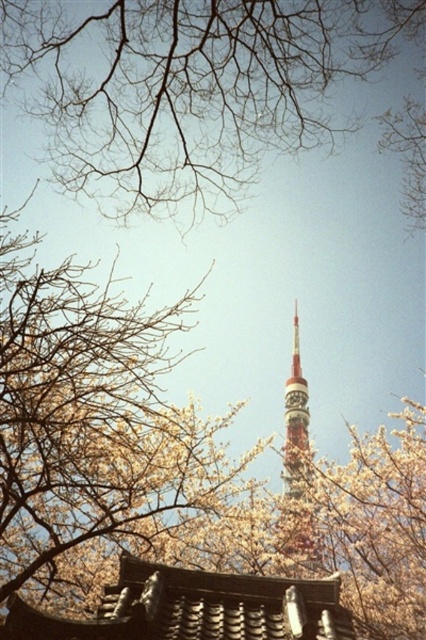
Between bare branches at upper center and shiny metallic tower at center, which one appears on the right side from the viewer's perspective?

Positioned to the right is shiny metallic tower at center.

Looking at this image, can you confirm if bare branches at upper center is thinner than shiny metallic tower at center?

No, bare branches at upper center is not thinner than shiny metallic tower at center.

At what (x,y) coordinates should I click in order to perform the action: click on bare branches at upper center. Please return your answer as a coordinate pair (x, y). Looking at the image, I should click on (190, 88).

Where is `bare branches at upper center`? bare branches at upper center is located at coordinates (190, 88).

Is fluffy white blossoms at center above shiny metallic tower at center?

Indeed, fluffy white blossoms at center is positioned over shiny metallic tower at center.

Looking at this image, who is more forward, (x=31, y=401) or (x=311, y=563)?

Positioned in front is point (x=31, y=401).

The height and width of the screenshot is (640, 426). What do you see at coordinates (91, 419) in the screenshot? I see `fluffy white blossoms at center` at bounding box center [91, 419].

Identify the location of fluffy white blossoms at center. This screenshot has height=640, width=426. (91, 419).

Can you confirm if bare branches at upper center is thinner than fluffy white blossoms at center?

Incorrect, bare branches at upper center's width is not less than fluffy white blossoms at center's.

Is point (100, 140) in front of point (14, 465)?

Yes, point (100, 140) is closer to viewer.

Identify the location of bare branches at upper center. (190, 88).

At what (x,y) coordinates should I click in order to perform the action: click on bare branches at upper center. Please return your answer as a coordinate pair (x, y). Looking at the image, I should click on (190, 88).